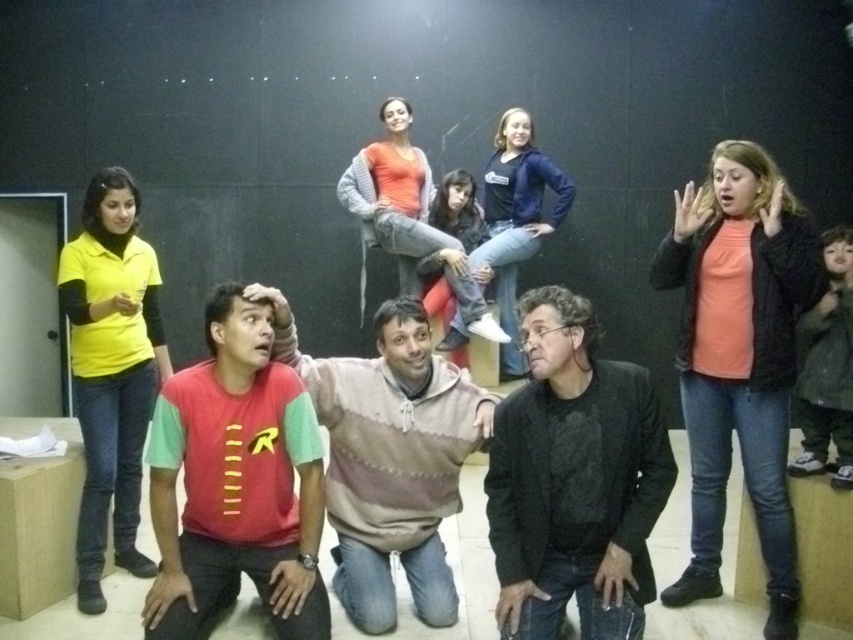
The image size is (853, 640). Find the location of `matte orange shirt at upper right`. matte orange shirt at upper right is located at coordinates (740, 356).

Looking at this image, which of these two, matte orange shirt at upper right or matte yellow shirt at left, stands taller?

Standing taller between the two is matte orange shirt at upper right.

Is point (718, 484) in front of point (138, 468)?

Yes, point (718, 484) is closer to viewer.

Find the location of `matte orange shirt at upper right`. matte orange shirt at upper right is located at coordinates (740, 356).

Based on the photo, which is more to the right, black textured blazer at center or matte yellow shirt at left?

black textured blazer at center

Which of these two, black textured blazer at center or matte yellow shirt at left, stands taller?

With more height is matte yellow shirt at left.

Is point (492, 448) closer to camera compared to point (142, 438)?

Yes, it is.

Where is `black textured blazer at center`? Image resolution: width=853 pixels, height=640 pixels. black textured blazer at center is located at coordinates (573, 481).

Who is lower down, matte orange shirt at upper right or red cotton t-shirt at center?

Positioned lower is red cotton t-shirt at center.

Which is more to the left, matte orange shirt at upper right or red cotton t-shirt at center?

red cotton t-shirt at center is more to the left.

Locate an element on the screen. This screenshot has height=640, width=853. matte orange shirt at upper right is located at coordinates (740, 356).